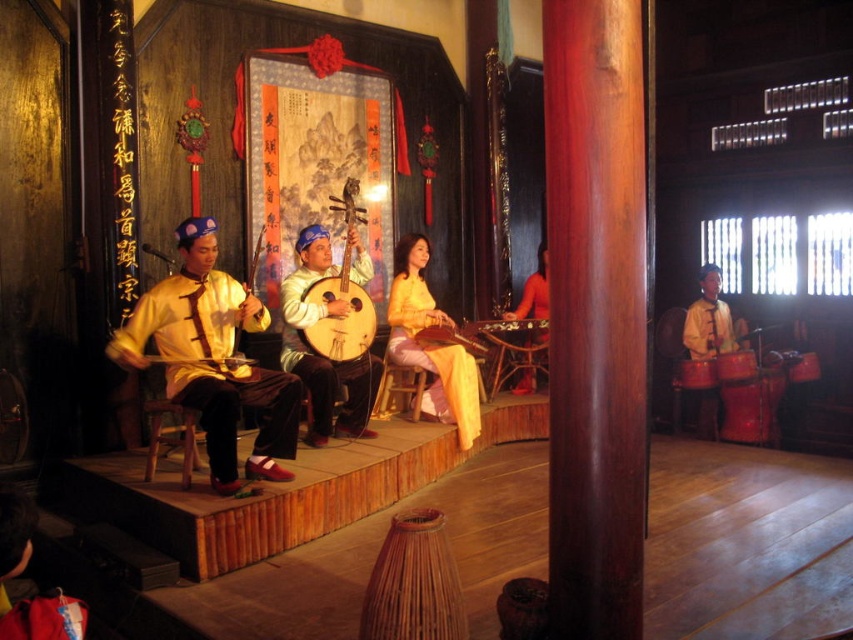
Which is more to the left, yellow satin dress at center or wooden stringed instrument at left?

wooden stringed instrument at left is more to the left.

Measure the distance between yellow satin dress at center and camera.

They are 16.33 feet apart.

Between point (410, 256) and point (231, 358), which one is positioned behind?

Positioned behind is point (410, 256).

You are a GUI agent. You are given a task and a screenshot of the screen. Output one action in this format:
    pyautogui.click(x=<x>, y=<y>)
    Task: Click on the yellow satin dress at center
    Image resolution: width=853 pixels, height=640 pixels.
    Given the screenshot: What is the action you would take?
    pyautogui.click(x=430, y=344)

Is matte yellow robe at center wider than shiny red drum at right?

Yes, matte yellow robe at center is wider than shiny red drum at right.

Does matte yellow robe at center lie behind shiny red drum at right?

No, matte yellow robe at center is closer to the viewer.

Does point (364, 422) come in front of point (697, 387)?

Yes, point (364, 422) is in front of point (697, 387).

The width and height of the screenshot is (853, 640). I want to click on matte yellow robe at center, so click(x=318, y=355).

Is matte yellow robe at center shorter than yellow satin dress at center?

Correct, matte yellow robe at center is not as tall as yellow satin dress at center.

Which is in front, point (373, 390) or point (451, 394)?

Positioned in front is point (373, 390).

Between point (368, 384) and point (416, 324), which one is positioned in front?

Point (368, 384) is in front.

Where is `matte yellow robe at center`? Image resolution: width=853 pixels, height=640 pixels. matte yellow robe at center is located at coordinates (318, 355).